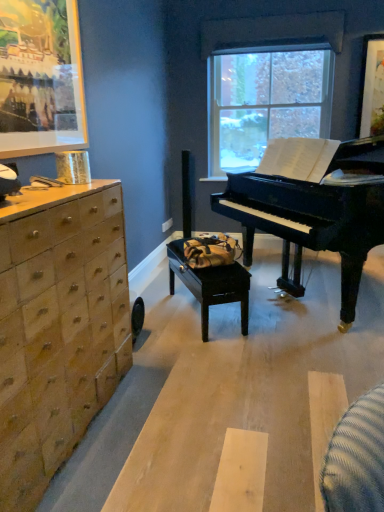
Question: Can we say wooden chest of drawers at left lies outside black wood table at center?

Choices:
 (A) yes
 (B) no

Answer: (A)

Question: Is wooden chest of drawers at left turned away from black wood table at center?

Choices:
 (A) no
 (B) yes

Answer: (A)

Question: Is wooden chest of drawers at left to the left of black wood table at center from the viewer's perspective?

Choices:
 (A) no
 (B) yes

Answer: (B)

Question: Does wooden chest of drawers at left lie behind black wood table at center?

Choices:
 (A) yes
 (B) no

Answer: (B)

Question: Does wooden chest of drawers at left touch black wood table at center?

Choices:
 (A) no
 (B) yes

Answer: (A)

Question: From the image's perspective, is clear glass window at center positioned above or below wooden chest of drawers at left?

Choices:
 (A) above
 (B) below

Answer: (A)

Question: Considering the positions of clear glass window at center and wooden chest of drawers at left in the image, is clear glass window at center wider or thinner than wooden chest of drawers at left?

Choices:
 (A) thin
 (B) wide

Answer: (A)

Question: Considering the positions of clear glass window at center and wooden chest of drawers at left in the image, is clear glass window at center bigger or smaller than wooden chest of drawers at left?

Choices:
 (A) big
 (B) small

Answer: (B)

Question: From a real-world perspective, is clear glass window at center above or below wooden chest of drawers at left?

Choices:
 (A) above
 (B) below

Answer: (A)

Question: Based on their sizes in the image, would you say wooden chest of drawers at left is bigger or smaller than black polished piano at center?

Choices:
 (A) small
 (B) big

Answer: (A)

Question: Considering the relative positions of wooden chest of drawers at left and black polished piano at center in the image provided, is wooden chest of drawers at left to the left or to the right of black polished piano at center?

Choices:
 (A) left
 (B) right

Answer: (A)

Question: From a real-world perspective, is wooden chest of drawers at left above or below black polished piano at center?

Choices:
 (A) above
 (B) below

Answer: (B)

Question: Looking at their shapes, would you say wooden chest of drawers at left is wider or thinner than black polished piano at center?

Choices:
 (A) wide
 (B) thin

Answer: (B)

Question: In the image, is black wood table at center on the left side or the right side of clear glass window at center?

Choices:
 (A) left
 (B) right

Answer: (A)

Question: Is black wood table at center spatially inside clear glass window at center, or outside of it?

Choices:
 (A) outside
 (B) inside

Answer: (A)